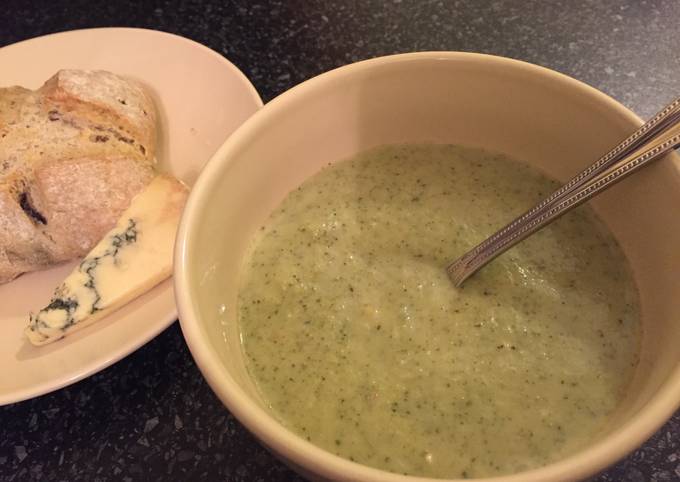
Identify the location of white ceramic plate. (211, 88).